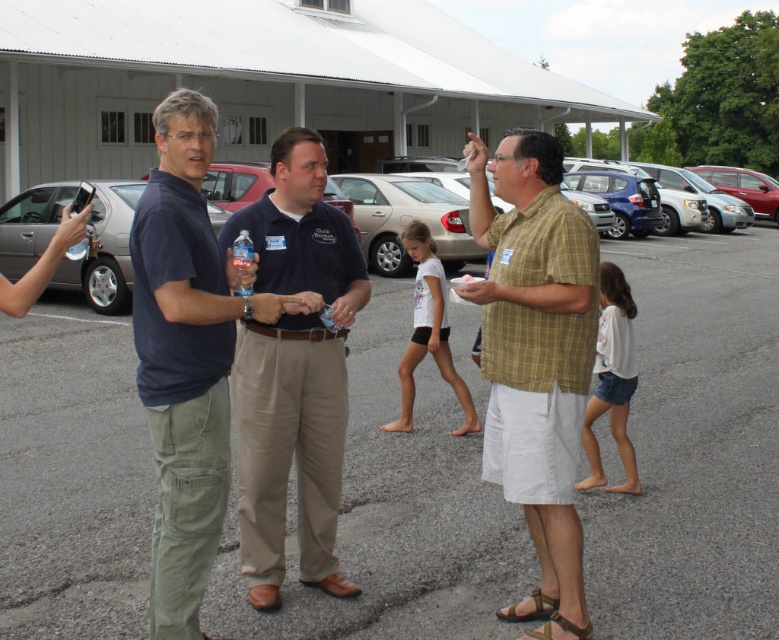
Which is above, khaki cotton pants at center or dark blue shirt at center?

dark blue shirt at center is above.

Does point (312, 467) come farther from viewer compared to point (189, 339)?

Yes, it is.

Describe the element at coordinates (294, 372) in the screenshot. I see `khaki cotton pants at center` at that location.

I want to click on khaki cotton pants at center, so click(x=294, y=372).

Does dark blue shirt at center appear on the left side of metallic silver sedan at center?

Yes, dark blue shirt at center is to the left of metallic silver sedan at center.

Is point (192, 316) positioned behind point (129, 188)?

No, it is in front of (129, 188).

You are a GUI agent. You are given a task and a screenshot of the screen. Output one action in this format:
    pyautogui.click(x=<x>, y=<y>)
    Task: Click on the dark blue shirt at center
    Image resolution: width=779 pixels, height=640 pixels.
    Given the screenshot: What is the action you would take?
    pyautogui.click(x=185, y=356)

Which is above, gray asphalt parking lot at center or khaki cotton pants at center?

khaki cotton pants at center is higher up.

Who is taller, gray asphalt parking lot at center or khaki cotton pants at center?

With more height is khaki cotton pants at center.

Who is more distant from viewer, (434, 625) or (347, 275)?

Point (347, 275)

The height and width of the screenshot is (640, 779). What are the coordinates of `gray asphalt parking lot at center` in the screenshot? It's located at (695, 445).